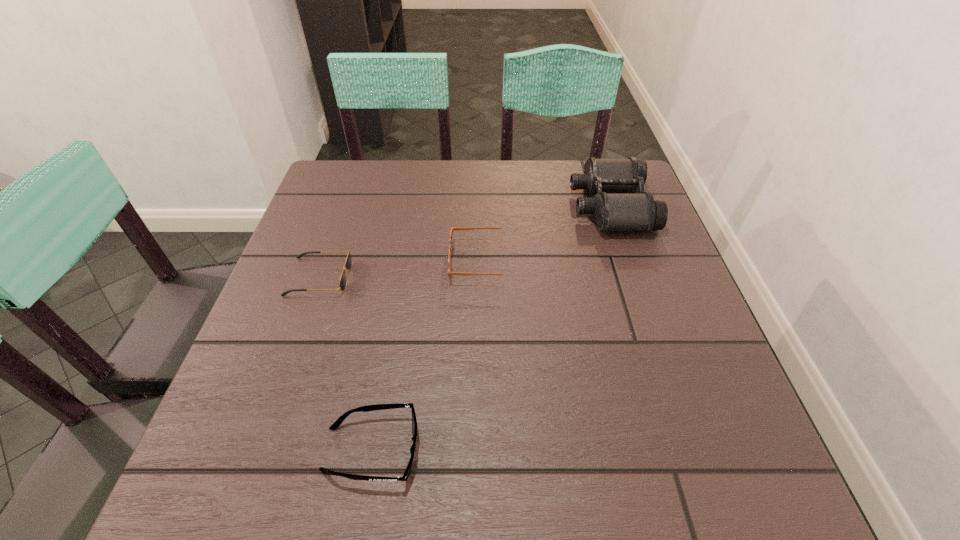
You are a GUI agent. You are given a task and a screenshot of the screen. Output one action in this format:
    pyautogui.click(x=<x>, y=<y>)
    Task: Click on the tallest object
    The height and width of the screenshot is (540, 960).
    Given the screenshot: What is the action you would take?
    pyautogui.click(x=616, y=207)

Locate an element on the screen. The image size is (960, 540). binoculars is located at coordinates (616, 207).

The height and width of the screenshot is (540, 960). I want to click on the rightmost sunglasses, so click(x=452, y=228).

Find the location of a particular element. The image size is (960, 540). the tallest sunglasses is located at coordinates (452, 228).

Find the location of `the leftmost object`. the leftmost object is located at coordinates (348, 263).

At what (x,y) coordinates should I click in order to perform the action: click on the second object from left to right. Please return your answer as a coordinate pair (x, y). This screenshot has width=960, height=540. Looking at the image, I should click on (337, 423).

The width and height of the screenshot is (960, 540). I want to click on the second sunglasses from right to left, so click(337, 423).

The width and height of the screenshot is (960, 540). In order to click on blank area located through the eyepieces of the rightmost object in this screenshot , I will do `click(419, 206)`.

This screenshot has height=540, width=960. I want to click on free space located through the eyepieces of the rightmost object, so click(x=461, y=206).

This screenshot has width=960, height=540. In order to click on vacant area located through the eyepieces of the rightmost object in this screenshot , I will do `click(453, 206)`.